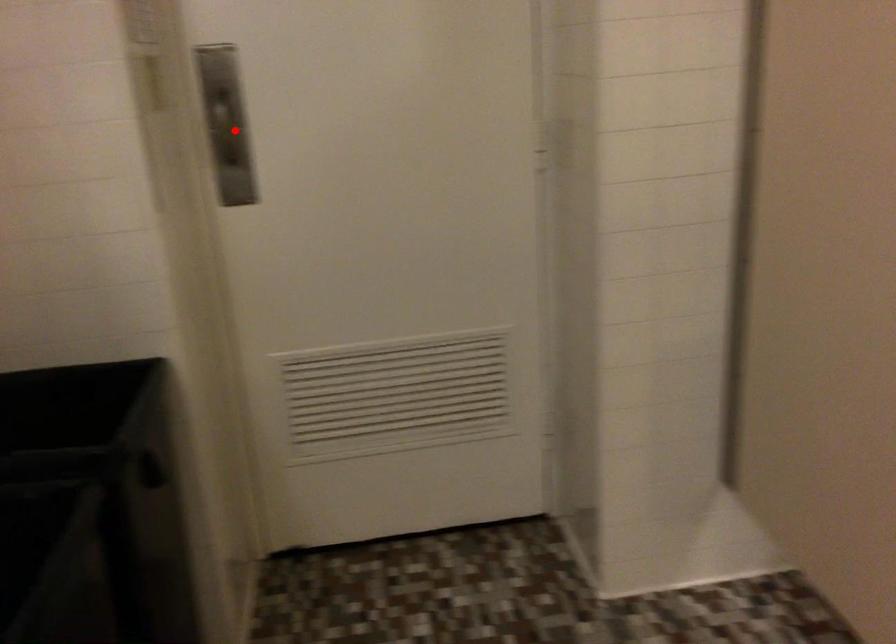
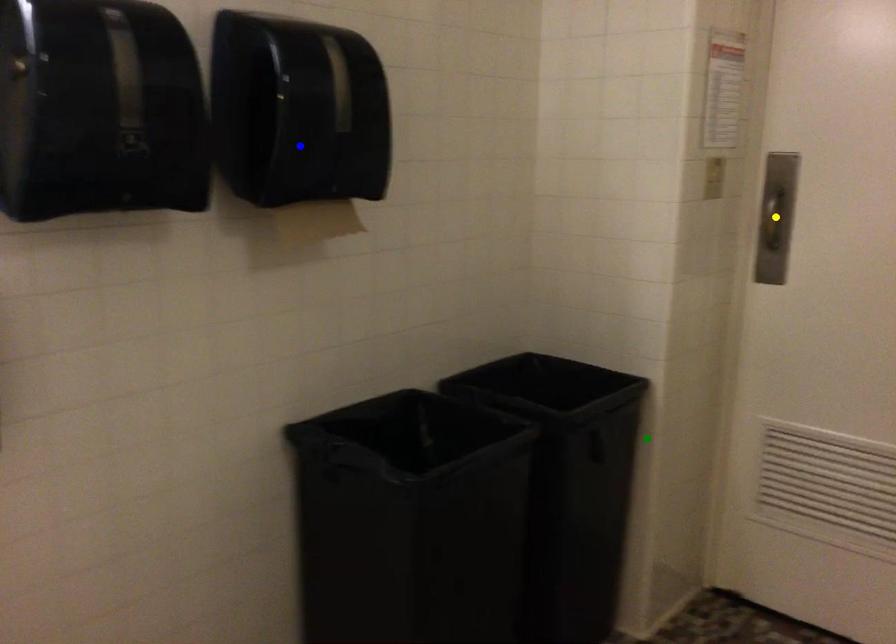
Question: I am providing you with two images of the same scene from different viewpoints. A red point is marked on the first image. You are given multiple points on the second image. In image 2, which mark is for the same physical point as the one in image 1?

Choices:
 (A) yellow point
 (B) green point
 (C) blue point

Answer: (A)